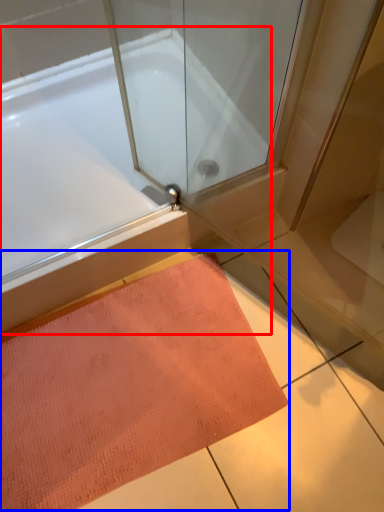
Question: Which object is closer to the camera taking this photo, bathtub (highlighted by a red box) or doormat (highlighted by a blue box)?

Choices:
 (A) bathtub
 (B) doormat

Answer: (B)